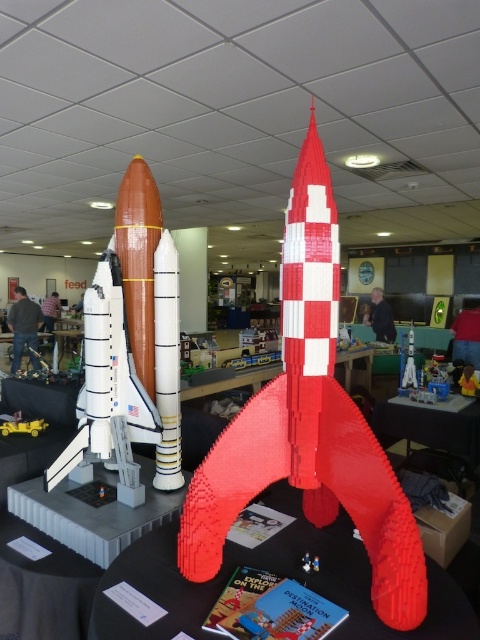
Between point (98, 452) and point (1, 417), which one is positioned behind?

Positioned behind is point (1, 417).

From the picture: Is matte white rocket at center to the left of yellow plastic toy car at center from the viewer's perspective?

In fact, matte white rocket at center is to the right of yellow plastic toy car at center.

Is point (131, 317) in front of point (7, 422)?

Yes.

Identify the location of matte white rocket at center. This screenshot has width=480, height=640. (127, 346).

Between matte white rocket at center and red plastic table at center, which one is positioned lower?

Positioned lower is red plastic table at center.

Can you confirm if matte white rocket at center is taller than red plastic table at center?

Indeed, matte white rocket at center has a greater height compared to red plastic table at center.

The width and height of the screenshot is (480, 640). What do you see at coordinates (127, 346) in the screenshot?
I see `matte white rocket at center` at bounding box center [127, 346].

Where is `matte white rocket at center`? This screenshot has width=480, height=640. matte white rocket at center is located at coordinates (127, 346).

Where is `red matte rocket at center`? red matte rocket at center is located at coordinates (309, 424).

Measure the distance between point (x=303, y=467) and camera.

Point (x=303, y=467) and camera are 5.27 feet apart from each other.

Locate an element on the screen. This screenshot has height=640, width=480. red matte rocket at center is located at coordinates (309, 424).